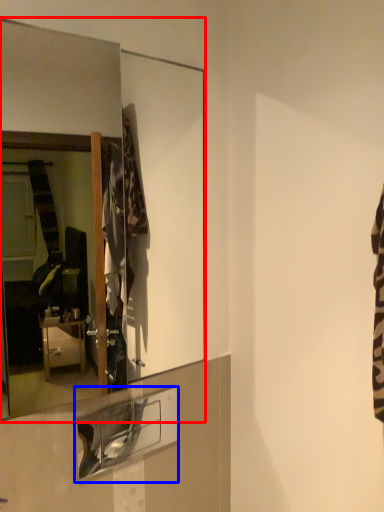
Question: Which of the following is the closest to the observer, mirror (highlighted by a red box) or shelf (highlighted by a blue box)?

Choices:
 (A) mirror
 (B) shelf

Answer: (A)